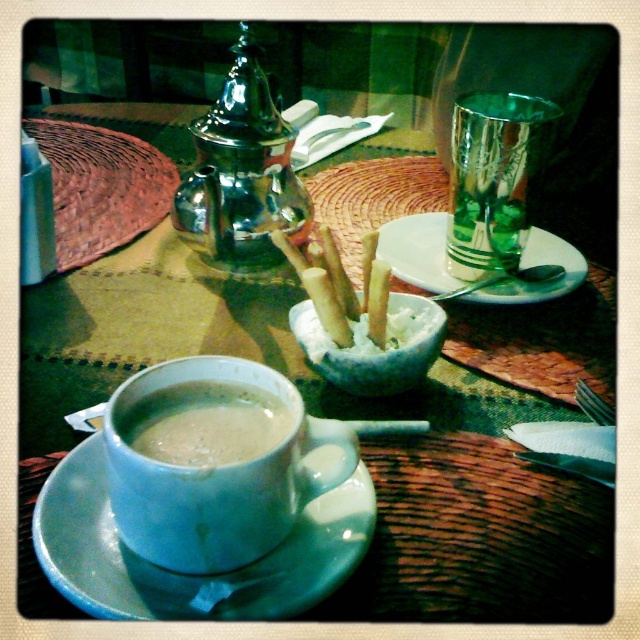
You are a customer at a cafe and want to reach for both the white glossy mug at center and the white creamy sticks at center. If your hand can only extend 3 inches, will you be able to grab both items without moving your arm?

The distance between the white glossy mug at center and the white creamy sticks at center is 3.35 inches. Since your hand can only extend 3 inches, you cannot reach both items without moving your arm.

You are a customer at the table and want to reach the transparent glass at upper right without moving your chair. Can you comfortably reach it if your arm can extend 14 inches?

The transparent glass at upper right is 13.40 inches from viewer, so yes, you can comfortably reach it since your arm can extend 14 inches.

You are a customer at a cafe and want to place your spoon from the white creamy sticks at center into the white glossy mug at center. Based on the objects in the scene, will the spoon fit inside the mug?

The white glossy mug at center might be wider than white creamy sticks at center, so the spoon from the white creamy sticks at center might fit inside the mug if the mug is wider.